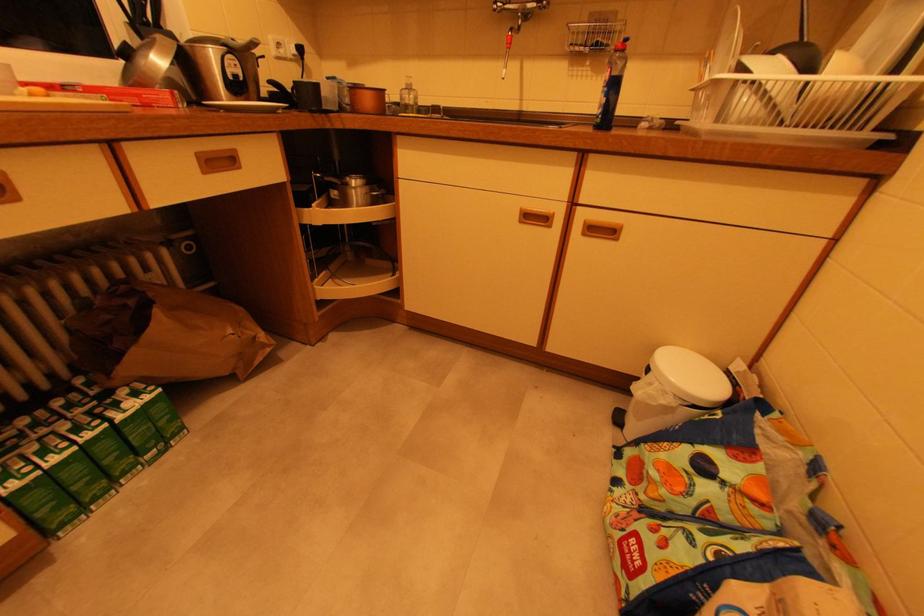
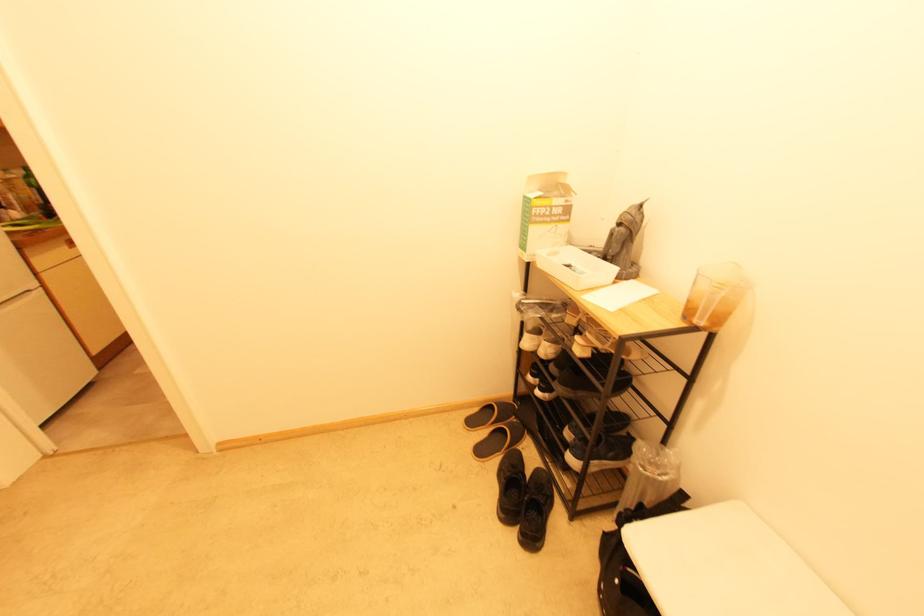
Question: I am providing you with two images of the same scene from different viewpoints. After the viewpoint changes to image2, which objects are now occluded?

Choices:
 (A) blue soap bottle
 (B) grey figurine
 (C) plastic liquid container
 (D) black laundry hamper

Answer: (A)